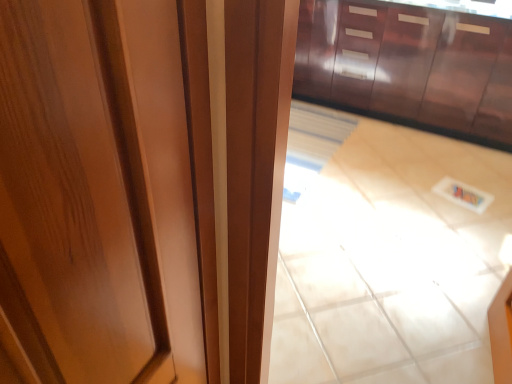
Question: Is glossy wood cabinetry at upper center taller or shorter than glossy wood door at center?

Choices:
 (A) short
 (B) tall

Answer: (A)

Question: Considering the relative positions of glossy wood cabinetry at upper center and glossy wood door at center in the image provided, is glossy wood cabinetry at upper center to the left or to the right of glossy wood door at center?

Choices:
 (A) right
 (B) left

Answer: (A)

Question: Estimate the real-world distances between objects in this image. Which object is closer to the beige glossy tile at center?

Choices:
 (A) glossy wood door at center
 (B) glossy wood cabinetry at upper center

Answer: (B)

Question: Which object is the closest to the glossy wood door at center?

Choices:
 (A) glossy wood cabinetry at upper center
 (B) beige glossy tile at center

Answer: (B)